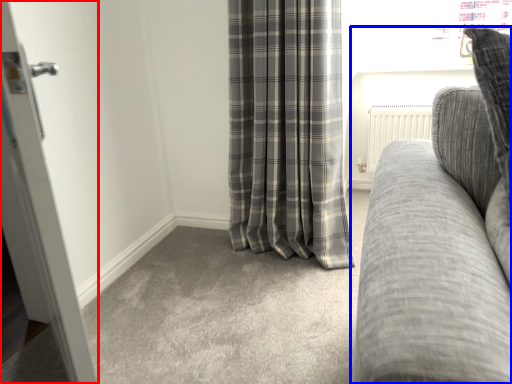
Question: Which object is further to the camera taking this photo, door (highlighted by a red box) or studio couch (highlighted by a blue box)?

Choices:
 (A) door
 (B) studio couch

Answer: (A)